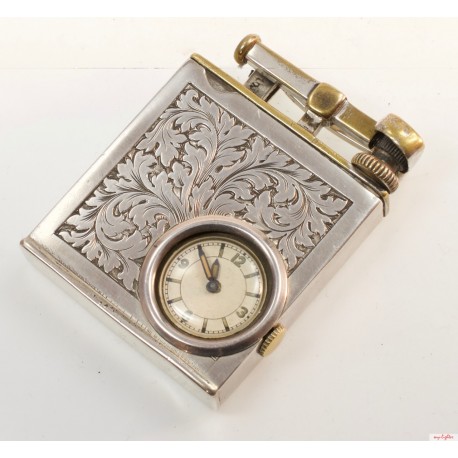
I want to click on clock face, so click(225, 303).